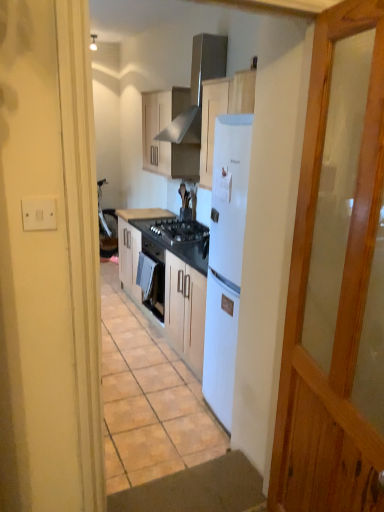
Question: Would you consider black granite countertop at center, positioned as the 2th countertop in top-to-bottom order, to be distant from white plastic switch at upper left?

Choices:
 (A) yes
 (B) no

Answer: (A)

Question: Can you confirm if black granite countertop at center, the first countertop when ordered from bottom to top, is thinner than white plastic switch at upper left?

Choices:
 (A) yes
 (B) no

Answer: (B)

Question: Is white plastic switch at upper left surrounded by black granite countertop at center, the first countertop when ordered from bottom to top?

Choices:
 (A) yes
 (B) no

Answer: (B)

Question: From a real-world perspective, is black granite countertop at center, the first countertop when ordered from bottom to top, on white plastic switch at upper left?

Choices:
 (A) yes
 (B) no

Answer: (B)

Question: Considering the relative sizes of black granite countertop at center, positioned as the 2th countertop in top-to-bottom order, and white plastic switch at upper left in the image provided, is black granite countertop at center, positioned as the 2th countertop in top-to-bottom order, wider than white plastic switch at upper left?

Choices:
 (A) yes
 (B) no

Answer: (A)

Question: From a real-world perspective, is black granite countertop at center, positioned as the 2th countertop in top-to-bottom order, physically located above or below white plastic switch at upper left?

Choices:
 (A) below
 (B) above

Answer: (A)

Question: Looking at the image, does black granite countertop at center, positioned as the 2th countertop in top-to-bottom order, seem bigger or smaller compared to white plastic switch at upper left?

Choices:
 (A) small
 (B) big

Answer: (B)

Question: Would you say black granite countertop at center, the first countertop when ordered from bottom to top, is inside or outside white plastic switch at upper left?

Choices:
 (A) outside
 (B) inside

Answer: (A)

Question: Does point (183, 231) appear closer or farther from the camera than point (34, 223)?

Choices:
 (A) closer
 (B) farther

Answer: (B)

Question: From the image's perspective, relative to black granite countertop at center, positioned as the 2th countertop in top-to-bottom order, is black laminate countertop at center, which is counted as the 1th countertop, starting from the top, above or below?

Choices:
 (A) below
 (B) above

Answer: (B)

Question: From a real-world perspective, is black laminate countertop at center, positioned as the 2th countertop in bottom-to-top order, above or below black granite countertop at center, the first countertop when ordered from bottom to top?

Choices:
 (A) below
 (B) above

Answer: (B)

Question: Considering the positions of point (153, 211) and point (206, 231), is point (153, 211) closer or farther from the camera than point (206, 231)?

Choices:
 (A) closer
 (B) farther

Answer: (B)

Question: Choose the correct answer: Is black laminate countertop at center, positioned as the 2th countertop in bottom-to-top order, inside black granite countertop at center, positioned as the 2th countertop in top-to-bottom order, or outside it?

Choices:
 (A) outside
 (B) inside

Answer: (B)

Question: From the image's perspective, relative to black glass gas stove at center, is white plastic switch at upper left above or below?

Choices:
 (A) below
 (B) above

Answer: (A)

Question: Visually, is white plastic switch at upper left positioned to the left or to the right of black glass gas stove at center?

Choices:
 (A) left
 (B) right

Answer: (A)